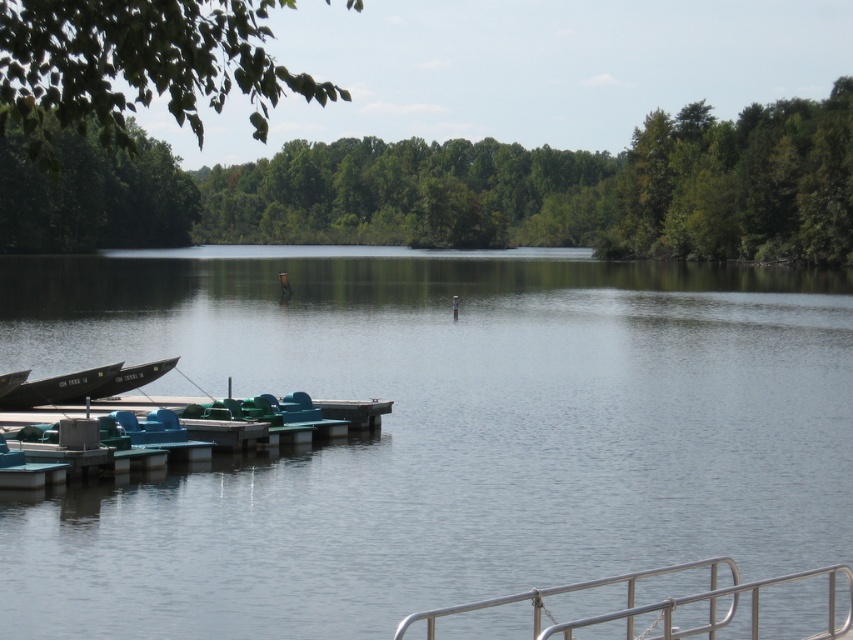
Is point (115, 413) positioned behind point (840, 628)?

That is True.

Is teal plastic boats at lower left wider than silver metallic railing at lower right?

Indeed, teal plastic boats at lower left has a greater width compared to silver metallic railing at lower right.

Is point (219, 419) farther from viewer compared to point (680, 564)?

Yes, point (219, 419) is farther from viewer.

Locate an element on the screen. teal plastic boats at lower left is located at coordinates (187, 408).

Is point (57, 20) closer to camera compared to point (850, 611)?

That is True.

Does green leafy branch at upper left lie in front of silver metallic railing at lower right?

Yes, green leafy branch at upper left is closer to the viewer.

Does point (253, 58) come behind point (450, 611)?

No.

I want to click on green leafy branch at upper left, so click(x=138, y=65).

Between clear water at center and green leafy tree at center, which one has less height?

clear water at center

Can you confirm if clear water at center is shorter than green leafy tree at center?

Correct, clear water at center is not as tall as green leafy tree at center.

Is point (746, 372) farther from viewer compared to point (735, 176)?

That is False.

Image resolution: width=853 pixels, height=640 pixels. In order to click on clear water at center in this screenshot , I will do `click(434, 433)`.